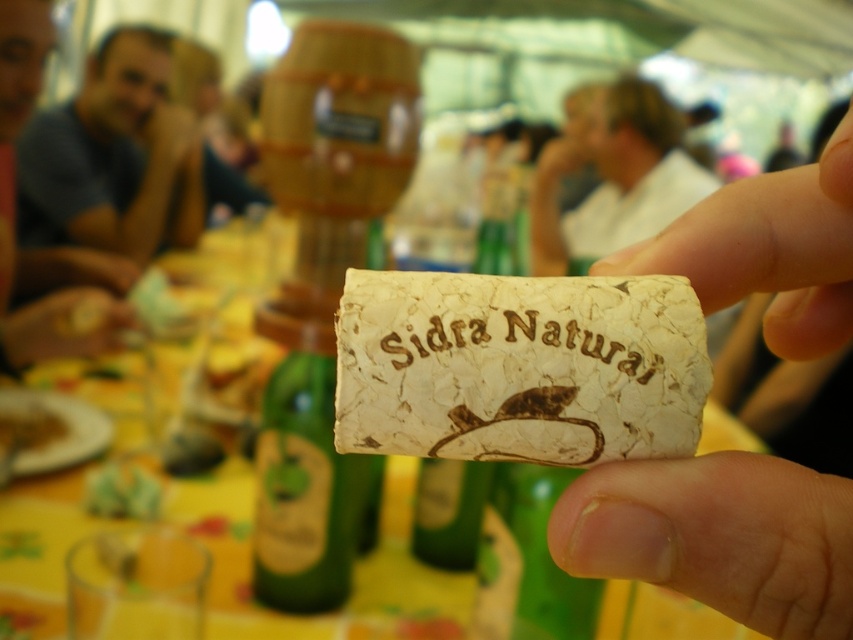
You are at a festival and see a smooth yellow lemon at lower left and a green leafy vegetable at lower left on the table. Which one is bigger?

The smooth yellow lemon at lower left is larger in size compared to the green leafy vegetable at lower left.

You are a photographer standing at the camera position. You want to take a photo of the smooth yellow lemon at lower left without moving the lemon. Can you adjust your position to get closer to the lemon so that you can take a clear photo?

The smooth yellow lemon at lower left and camera are 34.64 inches apart. Since you can move closer, you can reduce the distance to achieve a clearer photo.

You are at a festival under a tent and see a hand holding a cork labeled Sidra Natural. There is a point marked at coordinates (114, 156). What object is located at this point?

The point at coordinates (114, 156) indicates the blue cotton shirt at upper left.